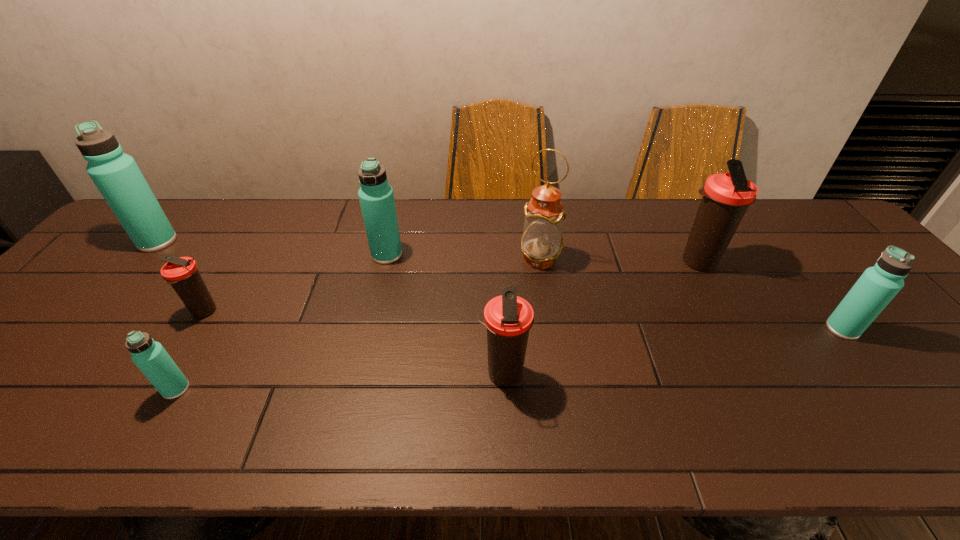
You are a GUI agent. You are given a task and a screenshot of the screen. Output one action in this format:
    pyautogui.click(x=<x>, y=<y>)
    Task: Click on the vacant area that lies between the smallest aqua thermos bottle and the farthest brown thermos bottle
    
    Given the screenshot: What is the action you would take?
    point(437,326)

The height and width of the screenshot is (540, 960). Identify the location of vacant area that lies between the leftmost aqua thermos bottle and the fourth thermos bottle from right to left. (272, 248).

Where is `free space between the fourth thermos bottle from right to left and the third farthest aqua thermos bottle`? The height and width of the screenshot is (540, 960). free space between the fourth thermos bottle from right to left and the third farthest aqua thermos bottle is located at coordinates (614, 292).

Locate an element on the screen. The image size is (960, 540). vacant area that lies between the oil lamp and the smallest aqua thermos bottle is located at coordinates (358, 324).

Find the location of a particular element. free space between the third smallest aqua thermos bottle and the second biggest brown thermos bottle is located at coordinates (444, 314).

Locate an element on the screen. free space between the rightmost object and the biggest brown thermos bottle is located at coordinates (770, 295).

Where is `unoccupied area between the second aqua thermos bottle from right to left and the biggest aqua thermos bottle`? unoccupied area between the second aqua thermos bottle from right to left and the biggest aqua thermos bottle is located at coordinates (272, 248).

Locate an element on the screen. free point between the second object from right to left and the smallest aqua thermos bottle is located at coordinates (437, 326).

Locate which object ranks seventh in proximity to the smallest aqua thermos bottle. Please provide its 2D coordinates. Your answer should be formatted as a tuple, i.e. [(x, y)], where the tuple contains the x and y coordinates of a point satisfying the conditions above.

[(878, 285)]

Where is `object that stands as the second closest to the seventh object from left to right`? This screenshot has height=540, width=960. object that stands as the second closest to the seventh object from left to right is located at coordinates (542, 241).